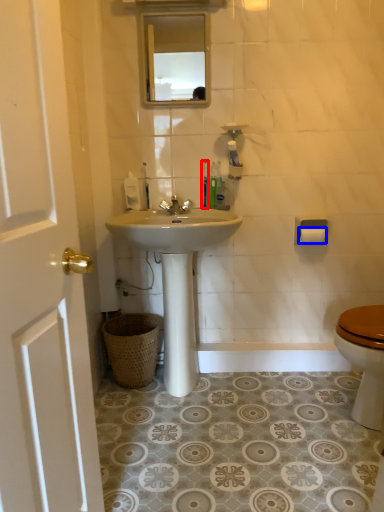
Question: Among these objects, which one is farthest to the camera, toothbrush (highlighted by a red box) or toilet paper (highlighted by a blue box)?

Choices:
 (A) toothbrush
 (B) toilet paper

Answer: (B)